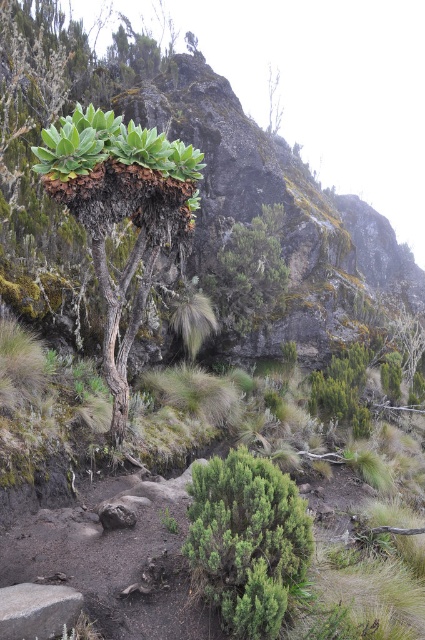
Question: Can you confirm if green leafy plant at center is positioned to the right of green leafy bush at center?

Choices:
 (A) no
 (B) yes

Answer: (A)

Question: Which of the following is the farthest from the observer?

Choices:
 (A) (209, 568)
 (B) (116, 296)

Answer: (B)

Question: Where is green leafy bush at center located in relation to gray rock at lower left in the image?

Choices:
 (A) right
 (B) left

Answer: (A)

Question: Which of the following is the closest to the observer?

Choices:
 (A) (53, 621)
 (B) (132, 252)

Answer: (A)

Question: Does green leafy bush at center have a greater width compared to gray rock at lower left?

Choices:
 (A) no
 (B) yes

Answer: (B)

Question: Estimate the real-world distances between objects in this image. Which object is farther from the gray rock at lower left?

Choices:
 (A) green leafy plant at center
 (B) green leafy bush at center

Answer: (A)